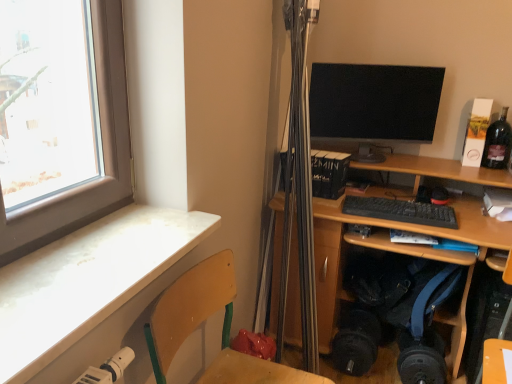
Question: Is matte black monitor at upper right not within dark glass bottle at upper right?

Choices:
 (A) yes
 (B) no

Answer: (A)

Question: Does matte black monitor at upper right have a greater width compared to dark glass bottle at upper right?

Choices:
 (A) no
 (B) yes

Answer: (B)

Question: From a real-world perspective, is matte black monitor at upper right over dark glass bottle at upper right?

Choices:
 (A) no
 (B) yes

Answer: (B)

Question: Are matte black monitor at upper right and dark glass bottle at upper right beside each other?

Choices:
 (A) no
 (B) yes

Answer: (A)

Question: Considering the relative sizes of matte black monitor at upper right and dark glass bottle at upper right in the image provided, is matte black monitor at upper right shorter than dark glass bottle at upper right?

Choices:
 (A) yes
 (B) no

Answer: (B)

Question: Visually, is white marble desk at lower left, acting as the 1th desk starting from the left, positioned to the left or to the right of wooden at left?

Choices:
 (A) left
 (B) right

Answer: (A)

Question: Is point (4, 357) closer or farther from the camera than point (237, 355)?

Choices:
 (A) closer
 (B) farther

Answer: (A)

Question: Considering the positions of white marble desk at lower left, arranged as the second desk when viewed from the back, and wooden at left in the image, is white marble desk at lower left, arranged as the second desk when viewed from the back, bigger or smaller than wooden at left?

Choices:
 (A) big
 (B) small

Answer: (B)

Question: Looking at their shapes, would you say white marble desk at lower left, acting as the 1th desk starting from the left, is wider or thinner than wooden at left?

Choices:
 (A) thin
 (B) wide

Answer: (A)

Question: From a real-world perspective, is dark glass bottle at upper right above or below wooden at left?

Choices:
 (A) above
 (B) below

Answer: (A)

Question: Considering the positions of dark glass bottle at upper right and wooden at left in the image, is dark glass bottle at upper right wider or thinner than wooden at left?

Choices:
 (A) wide
 (B) thin

Answer: (B)

Question: Is dark glass bottle at upper right taller or shorter than wooden at left?

Choices:
 (A) tall
 (B) short

Answer: (B)

Question: From the image's perspective, is dark glass bottle at upper right located above or below wooden at left?

Choices:
 (A) below
 (B) above

Answer: (B)

Question: Visually, is white marble desk at lower left, the first desk positioned from the front, positioned to the left or to the right of matte black monitor at upper right?

Choices:
 (A) left
 (B) right

Answer: (A)

Question: From a real-world perspective, is white marble desk at lower left, the first desk positioned from the front, physically located above or below matte black monitor at upper right?

Choices:
 (A) above
 (B) below

Answer: (B)